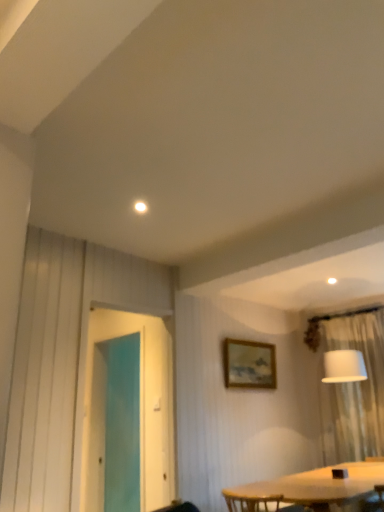
Question: Does white sheer curtain at right have a greater width compared to transparent glass screen door at left?

Choices:
 (A) no
 (B) yes

Answer: (B)

Question: From a real-world perspective, is white sheer curtain at right on transparent glass screen door at left?

Choices:
 (A) yes
 (B) no

Answer: (B)

Question: Is white sheer curtain at right in contact with transparent glass screen door at left?

Choices:
 (A) no
 (B) yes

Answer: (A)

Question: Is the depth of white sheer curtain at right less than that of transparent glass screen door at left?

Choices:
 (A) yes
 (B) no

Answer: (B)

Question: Considering the relative positions of white sheer curtain at right and transparent glass screen door at left in the image provided, is white sheer curtain at right to the left of transparent glass screen door at left from the viewer's perspective?

Choices:
 (A) yes
 (B) no

Answer: (B)

Question: Is white sheer curtain at right positioned with its back to transparent glass screen door at left?

Choices:
 (A) yes
 (B) no

Answer: (B)

Question: From the image's perspective, would you say transparent glass screen door at left is positioned over white sheer curtain at right?

Choices:
 (A) yes
 (B) no

Answer: (A)

Question: From a real-world perspective, is transparent glass screen door at left beneath white sheer curtain at right?

Choices:
 (A) no
 (B) yes

Answer: (A)

Question: Does transparent glass screen door at left have a smaller size compared to white sheer curtain at right?

Choices:
 (A) yes
 (B) no

Answer: (A)

Question: From a real-world perspective, does transparent glass screen door at left stand above white sheer curtain at right?

Choices:
 (A) no
 (B) yes

Answer: (B)

Question: Does transparent glass screen door at left have a larger size compared to white sheer curtain at right?

Choices:
 (A) yes
 (B) no

Answer: (B)

Question: Does transparent glass screen door at left appear on the right side of white sheer curtain at right?

Choices:
 (A) yes
 (B) no

Answer: (B)

Question: Considering the relative positions of transparent glass screen door at left and wooden frame at upper center in the image provided, is transparent glass screen door at left to the right of wooden frame at upper center from the viewer's perspective?

Choices:
 (A) yes
 (B) no

Answer: (B)